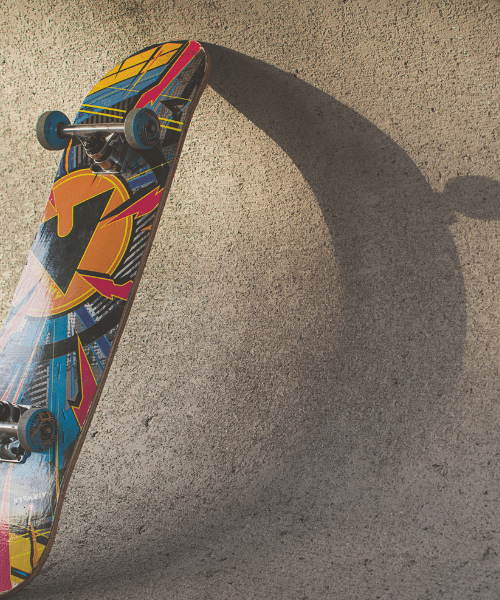
This screenshot has height=600, width=500. In order to click on stain in this screenshot , I will do click(x=127, y=36).